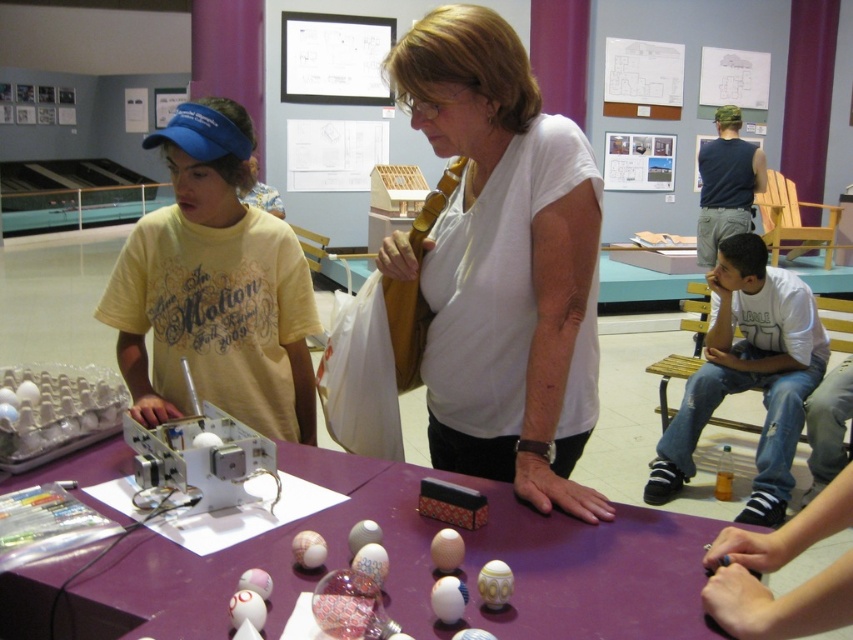
Question: Which object appears farthest from the camera in this image?

Choices:
 (A) white cotton shirt at right
 (B) purple matte table at center

Answer: (A)

Question: Which of the following is the closest to the observer?

Choices:
 (A) purple matte table at center
 (B) white cotton shirt at right

Answer: (A)

Question: Can you confirm if white matte shirt at center is wider than white cotton shirt at right?

Choices:
 (A) no
 (B) yes

Answer: (A)

Question: Is white matte shirt at center further to camera compared to white cotton shirt at right?

Choices:
 (A) yes
 (B) no

Answer: (B)

Question: Is yellow cotton shirt at left to the right of white cotton shirt at right from the viewer's perspective?

Choices:
 (A) no
 (B) yes

Answer: (A)

Question: Which is farther from the white cotton shirt at right?

Choices:
 (A) white matte shirt at center
 (B) yellow cotton shirt at left
 (C) purple matte table at center

Answer: (B)